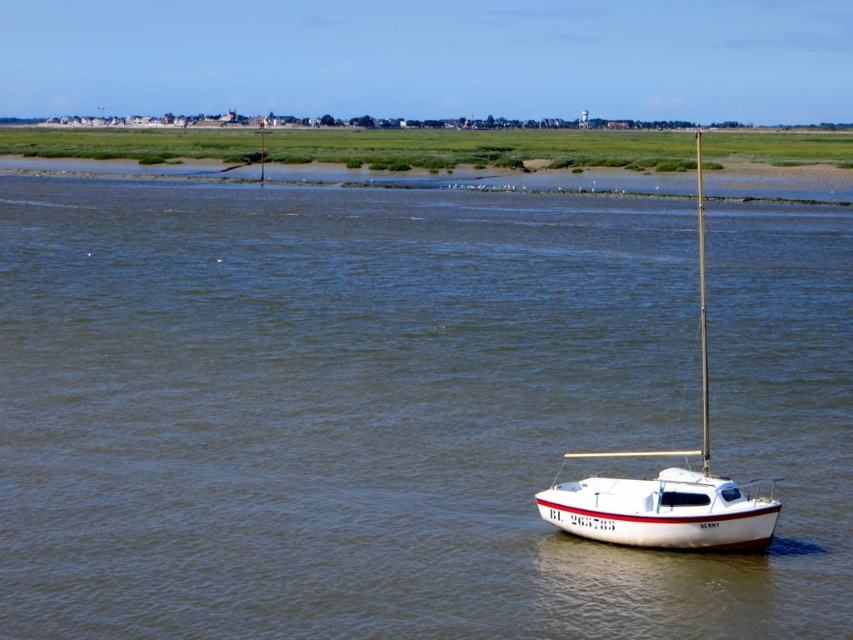
Question: Is brown water at center positioned in front of white glossy sailboat at center?

Choices:
 (A) yes
 (B) no

Answer: (A)

Question: Among these objects, which one is farthest from the camera?

Choices:
 (A) white glossy sailboat at center
 (B) brown water at center

Answer: (A)

Question: Can you confirm if brown water at center is bigger than white glossy sailboat at center?

Choices:
 (A) yes
 (B) no

Answer: (A)

Question: Which of the following is the farthest from the observer?

Choices:
 (A) (548, 493)
 (B) (480, 372)

Answer: (B)

Question: Does brown water at center lie in front of white glossy sailboat at center?

Choices:
 (A) no
 (B) yes

Answer: (B)

Question: Which of the following is the farthest from the observer?

Choices:
 (A) brown water at center
 (B) white glossy sailboat at center

Answer: (B)